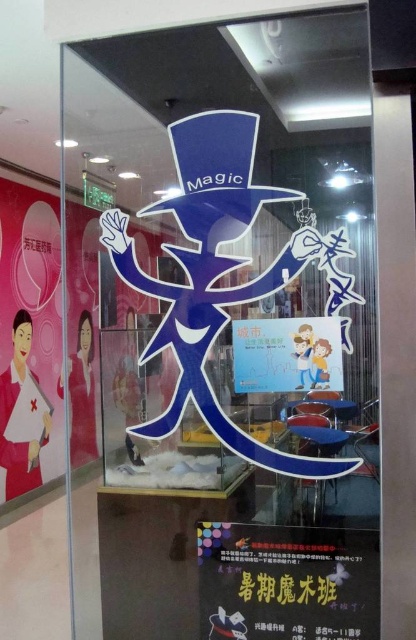
You are a store employee who needs to ensure the display case is safe for customers. The blue glossy magician at center and the matte black poster at lower center are both inside the case. Which object takes up more space in the display case?

The blue glossy magician at center is bigger than the matte black poster at lower center, so it takes up more space in the display case.

You are designing a layout for a magic show poster display. You have two posters to place side by side in the display case. The matte black poster at lower center and the matte paper poster at center. Which poster should you choose to occupy the wider space to ensure they both fit without overlapping?

The matte black poster at lower center might be wider than the matte paper poster at center, so choosing the matte black poster at lower center for the wider space would ensure both fit without overlapping.